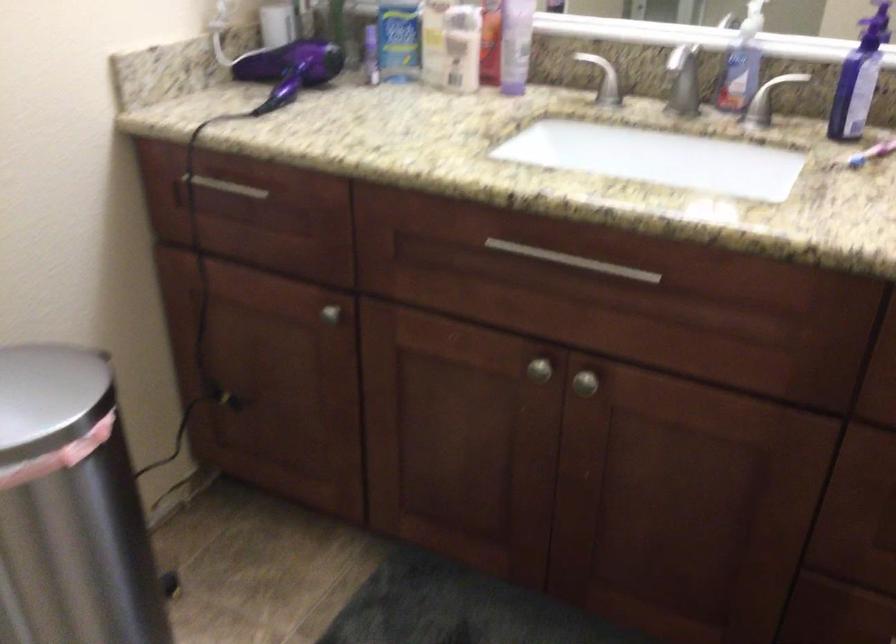
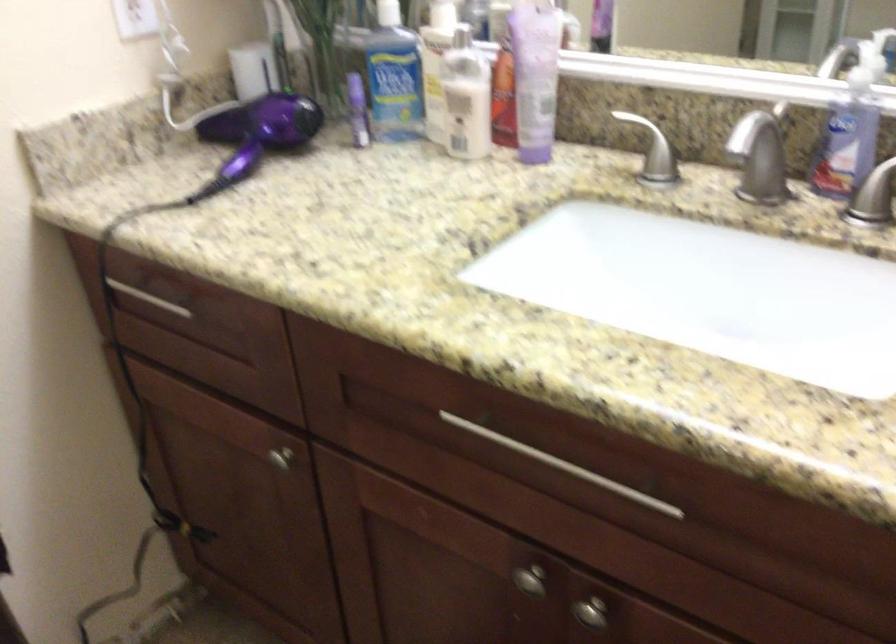
Where in the second image is the point corresponding to the point at 739,79 from the first image?

(846, 145)